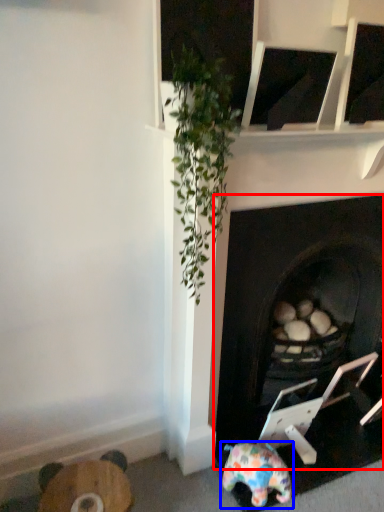
Question: Which of the following is the closest to the observer, fireplace (highlighted by a red box) or toy (highlighted by a blue box)?

Choices:
 (A) fireplace
 (B) toy

Answer: (A)